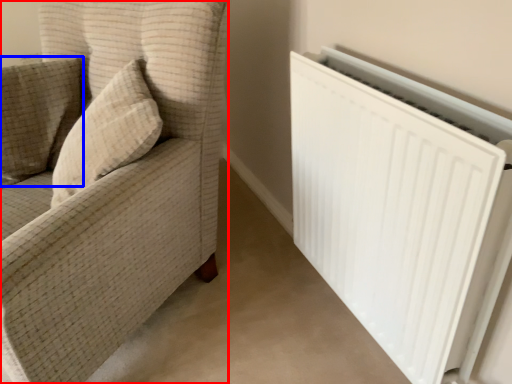
Question: Which of the following is the farthest to the observer, furniture (highlighted by a red box) or pillow (highlighted by a blue box)?

Choices:
 (A) furniture
 (B) pillow

Answer: (B)